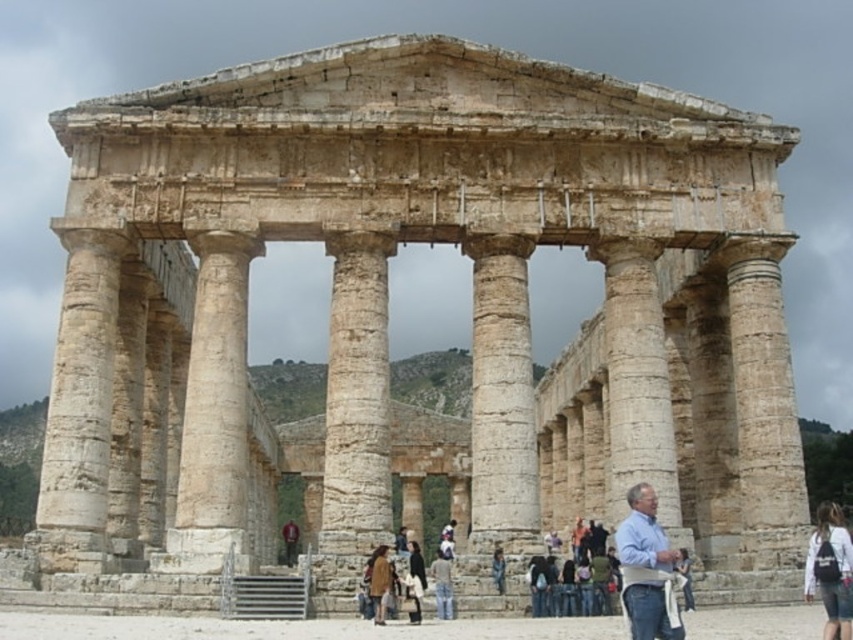
Question: From the image, what is the correct spatial relationship of denim pants at center in relation to dark brown leather jacket at lower center?

Choices:
 (A) right
 (B) left

Answer: (B)

Question: Which of the following is the farthest from the observer?

Choices:
 (A) light blue shirt at center
 (B) dark brown leather jacket at lower center

Answer: (B)

Question: Is smooth stone column at center wider than brown leather jacket at center?

Choices:
 (A) yes
 (B) no

Answer: (A)

Question: Which point is closer to the camera taking this photo?

Choices:
 (A) (437, 554)
 (B) (637, 554)

Answer: (B)

Question: Is beige stone column at center wider than white fabric backpack at lower right?

Choices:
 (A) no
 (B) yes

Answer: (A)

Question: Estimate the real-world distances between objects in this image. Which object is farther from the denim pants at center?

Choices:
 (A) smooth stone column at center
 (B) dark brown leather jacket at lower center
 (C) white stone column at center
 (D) white fabric backpack at lower right

Answer: (D)